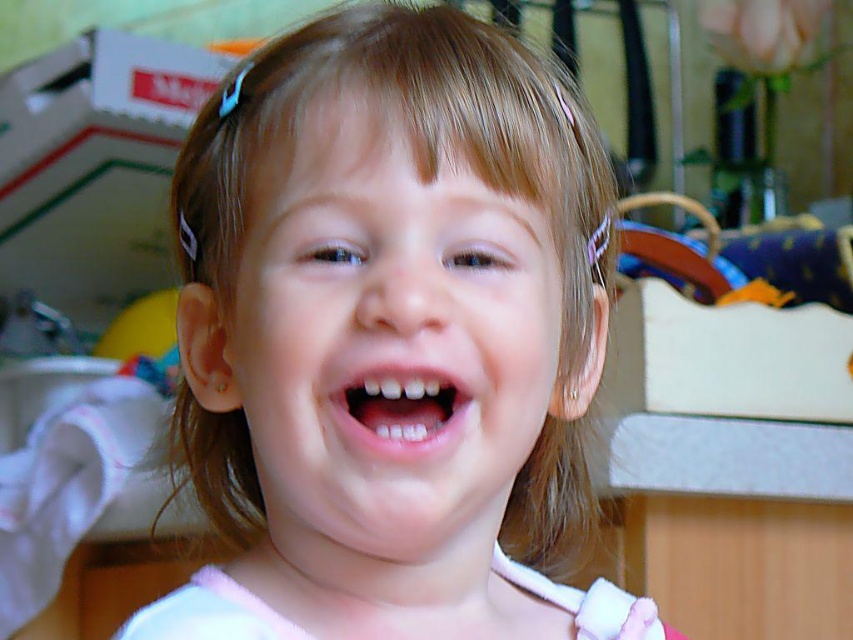
Question: Which point is closer to the camera?

Choices:
 (A) pink glossy lips at center
 (B) pink fabric at center

Answer: (B)

Question: Does pink fabric at center appear on the left side of pink glossy lips at center?

Choices:
 (A) yes
 (B) no

Answer: (A)

Question: Among these objects, which one is nearest to the camera?

Choices:
 (A) pink fabric at center
 (B) pink glossy lips at center

Answer: (A)

Question: Is pink fabric at center bigger than pink glossy lips at center?

Choices:
 (A) no
 (B) yes

Answer: (B)

Question: Is pink fabric at center above pink glossy lips at center?

Choices:
 (A) yes
 (B) no

Answer: (B)